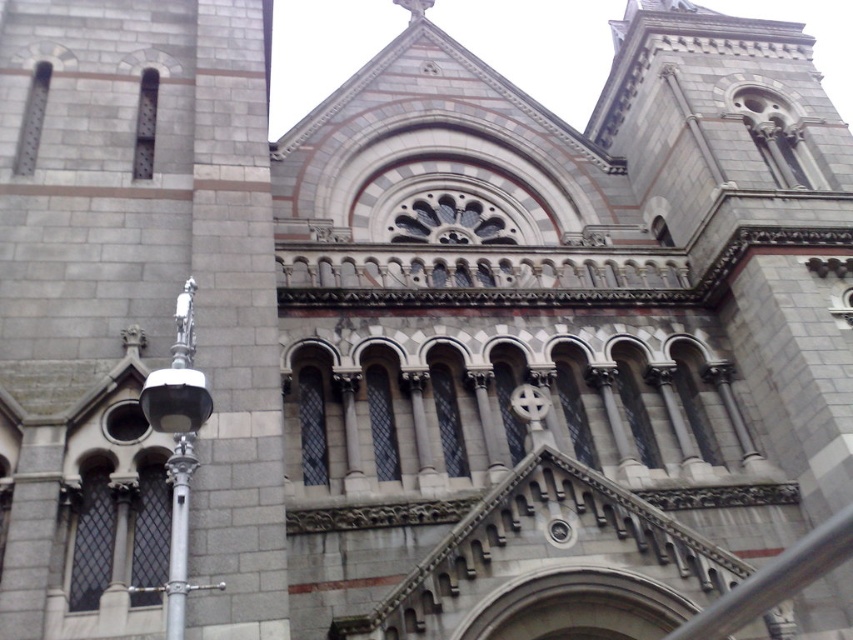
Is silver metallic streetlight at left thinner than metallic gray rail at lower right?

Correct, silver metallic streetlight at left's width is less than metallic gray rail at lower right's.

Is silver metallic streetlight at left smaller than metallic gray rail at lower right?

Actually, silver metallic streetlight at left might be larger than metallic gray rail at lower right.

Describe the element at coordinates (178, 449) in the screenshot. This screenshot has width=853, height=640. I see `silver metallic streetlight at left` at that location.

What are the coordinates of `silver metallic streetlight at left` in the screenshot? It's located at (178, 449).

What are the coordinates of `metallic gray rail at lower right` in the screenshot? It's located at (775, 580).

Is metallic gray rail at lower right in front of silver metallic pole at left?

No.

Between point (814, 564) and point (177, 564), which one is positioned in front?

Point (177, 564) is more forward.

Find the location of a particular element. metallic gray rail at lower right is located at coordinates (775, 580).

Is silver metallic streetlight at left above silver metallic pole at left?

Yes, silver metallic streetlight at left is above silver metallic pole at left.

Can you confirm if silver metallic streetlight at left is positioned to the left of silver metallic pole at left?

Yes, silver metallic streetlight at left is to the left of silver metallic pole at left.

Find the location of a particular element. The image size is (853, 640). silver metallic streetlight at left is located at coordinates (178, 449).